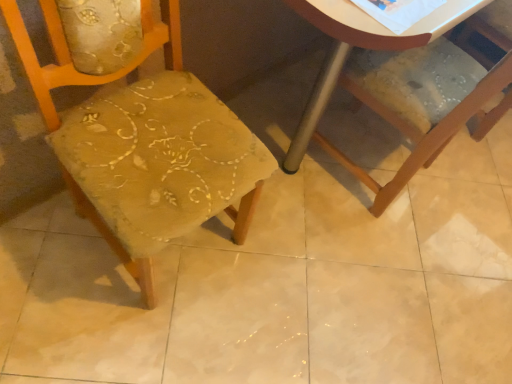
The image size is (512, 384). I want to click on vacant space in front of textured fabric chair at center, positioned as the first chair in left-to-right order, so click(x=105, y=324).